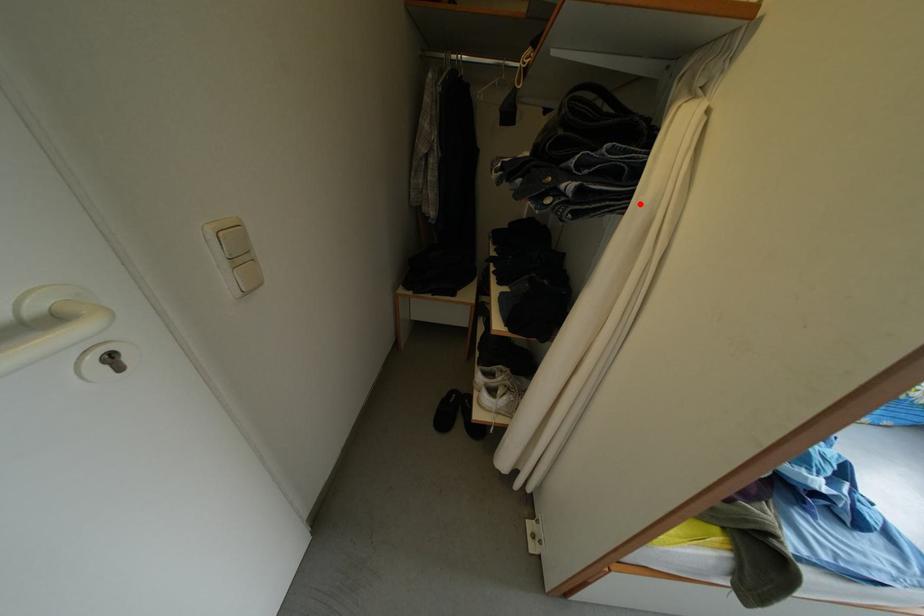
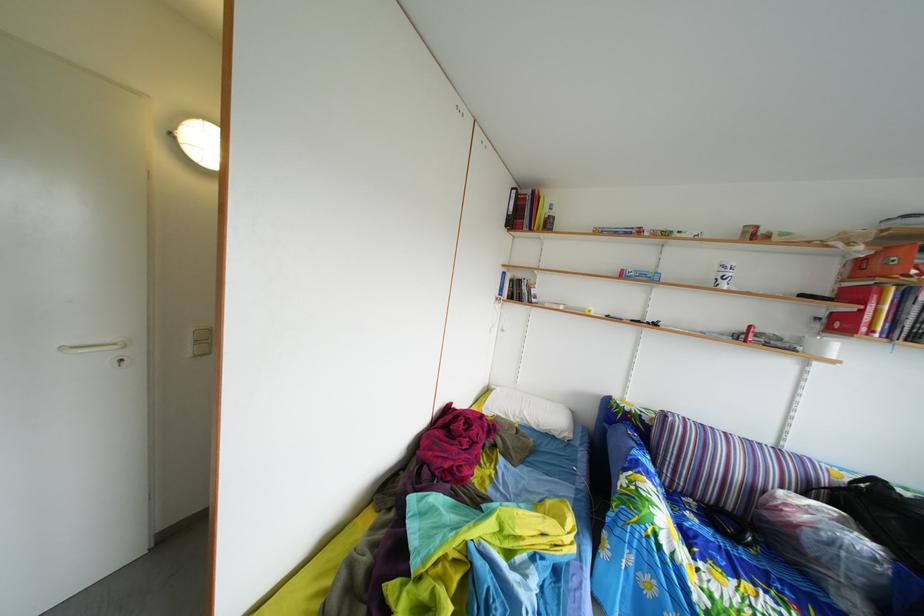
Question: I am providing you with two images of the same scene from different viewpoints. A red point is marked on the first image. Can you still see the location of the red point in image 2?

Choices:
 (A) Yes
 (B) No

Answer: (B)